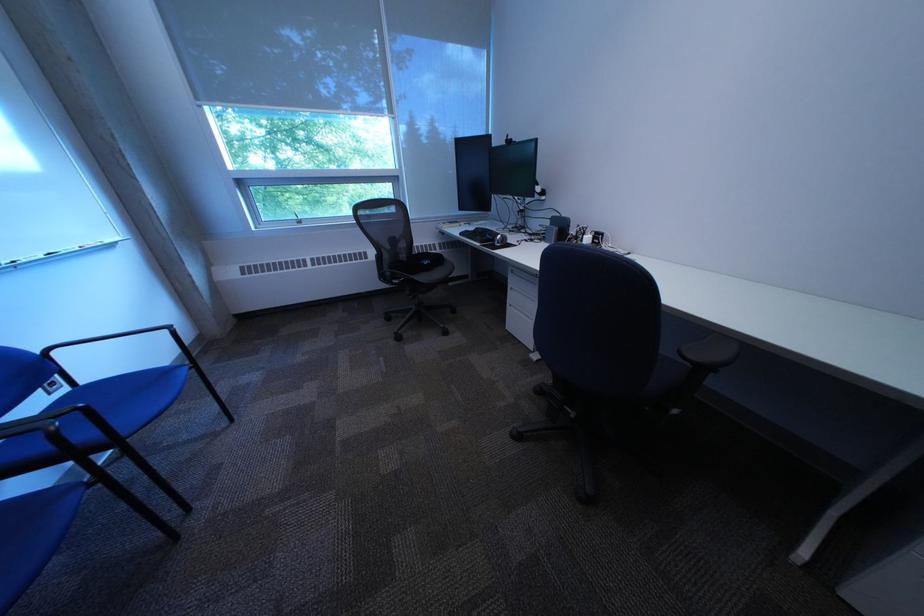
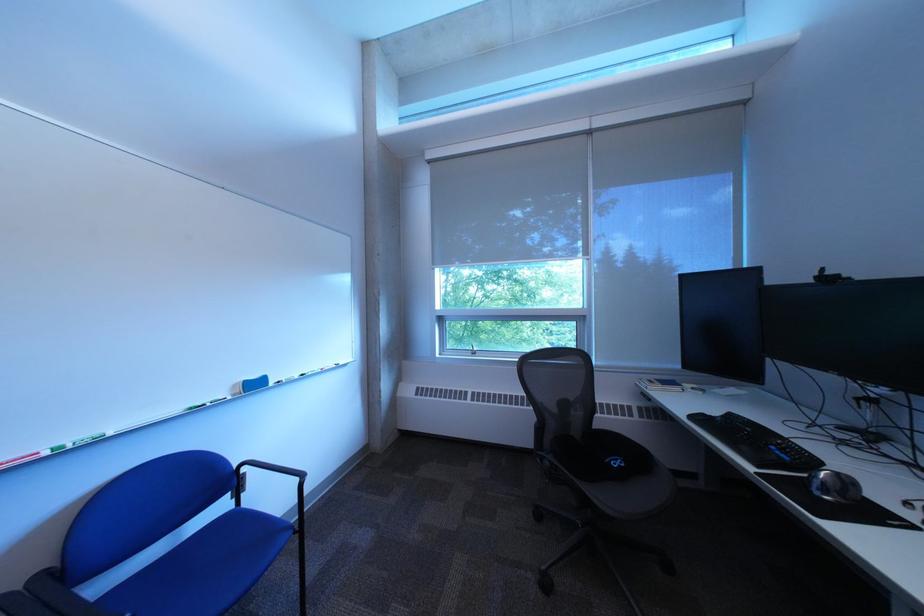
Locate, in the second image, the point that corresponds to (x=524, y=140) in the first image.

(843, 275)